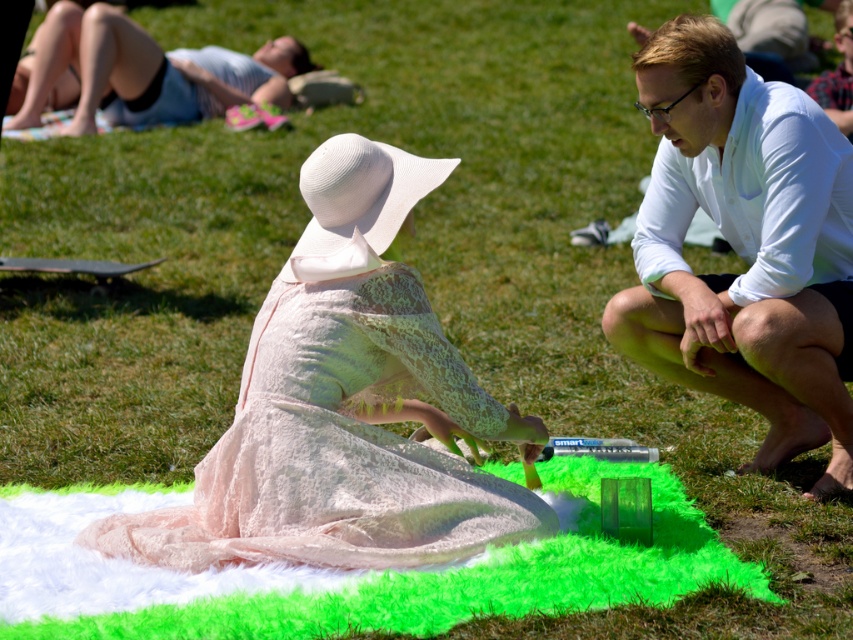
Question: Can you confirm if fluffy white blanket at lower center is positioned below light blue denim shorts at upper left?

Choices:
 (A) yes
 (B) no

Answer: (A)

Question: Is fluffy white blanket at lower center below light blue denim shorts at upper left?

Choices:
 (A) no
 (B) yes

Answer: (B)

Question: Estimate the real-world distances between objects in this image. Which object is farther from the white cotton shirt at right?

Choices:
 (A) fluffy white blanket at lower center
 (B) light pink lace dress at center
 (C) light blue denim shorts at upper left

Answer: (C)

Question: Is fluffy white blanket at lower center thinner than light blue denim shorts at upper left?

Choices:
 (A) yes
 (B) no

Answer: (A)

Question: Which point is farther to the camera?

Choices:
 (A) light blue denim shorts at upper left
 (B) light pink lace dress at center
 (C) fluffy white blanket at lower center
 (D) white cotton shirt at right

Answer: (A)

Question: Which of the following is the closest to the observer?

Choices:
 (A) (163, 528)
 (B) (193, 83)
 (C) (842, 250)
 (D) (412, 582)

Answer: (D)